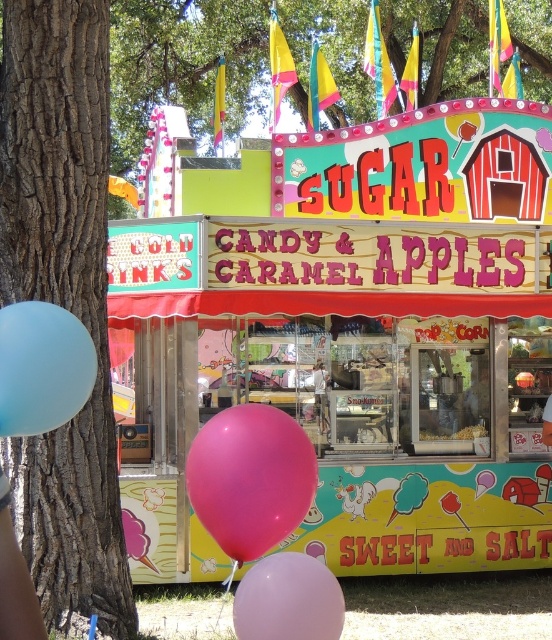
Question: Which point is closer to the camera?

Choices:
 (A) (283, 595)
 (B) (214, 504)
 (C) (34, 346)
 (D) (56, 451)

Answer: (C)

Question: Is pastel purple balloon at lower center thinner than light brown wooden sign at center?

Choices:
 (A) no
 (B) yes

Answer: (A)

Question: Which point appears farthest from the camera in this image?

Choices:
 (A) (321, 362)
 (B) (23, 371)
 (C) (283, 477)
 (D) (289, 600)

Answer: (A)

Question: In this image, where is brown rough bark at left located relative to pastel purple balloon at lower center?

Choices:
 (A) right
 (B) left

Answer: (B)

Question: Which object is the farthest from the pastel purple balloon at lower center?

Choices:
 (A) matte pink balloon at lower center
 (B) brown rough bark at left
 (C) white popcorn at center
 (D) light brown wooden sign at center

Answer: (C)

Question: Is matte pink balloon at lower center to the right of pink rubber balloon at lower center from the viewer's perspective?

Choices:
 (A) no
 (B) yes

Answer: (B)